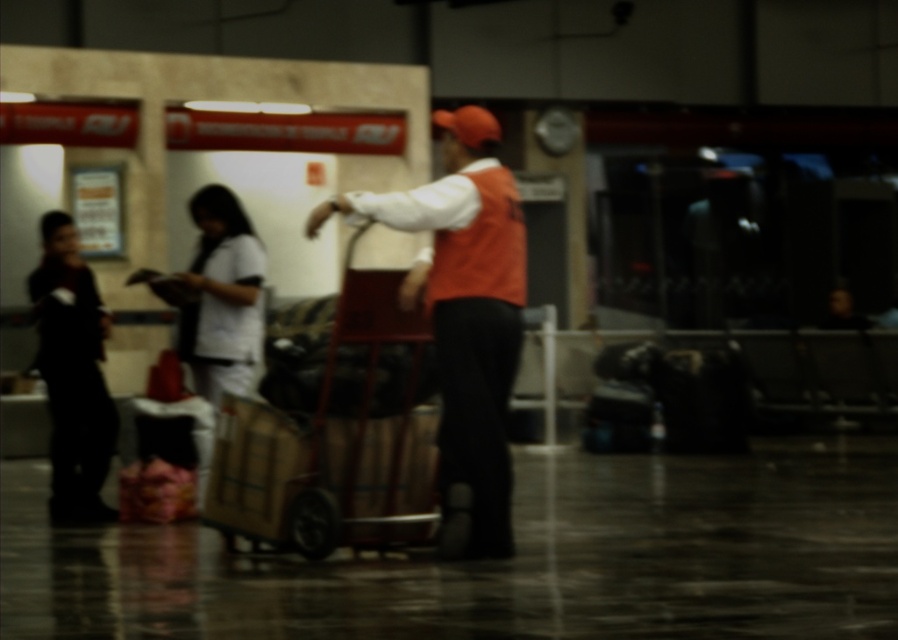
You are a passenger at the airport terminal and need to reach the wooden trolley at center. Considering the layout described, which direction should you head towards from your current position near the entrance?

The wooden trolley at center is located at point (x=332, y=444), so you should head towards the center of the terminal to reach it.

You are a passenger who just arrived at the airport terminal. You see a wooden trolley at center and a black matte jacket at left. Which object is closer to you?

The wooden trolley at center is closer to you because it is in front of the black matte jacket at left.

You are a passenger who just arrived at the airport terminal. You see a wooden trolley at center and a black matte jacket at left. Which object is taller?

The black matte jacket at left is taller than the wooden trolley at center.